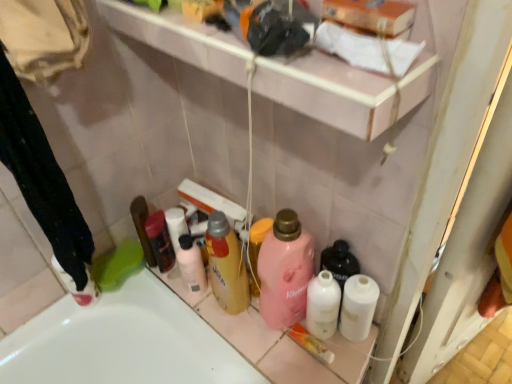
Question: In the image, is white paper towel at upper center positioned in front of or behind pink matte bottle at center, the first cleaning product positioned from the right?

Choices:
 (A) front
 (B) behind

Answer: (A)

Question: Considering the positions of point (417, 52) and point (312, 256), is point (417, 52) closer or farther from the camera than point (312, 256)?

Choices:
 (A) farther
 (B) closer

Answer: (B)

Question: Which is nearer to the black fabric laundry at lower left?

Choices:
 (A) white paper towel at upper center
 (B) matte black hair spray at left, placed as the 1th toiletry when sorted from left to right
 (C) translucent yellow bottle at center, the 2th cleaning product positioned from the right
 (D) pink matte lotion at center, positioned as the fourth toiletry in right-to-left order
 (E) pink matte bottle at center, the second cleaning product when ordered from left to right

Answer: (B)

Question: Which of these objects is positioned farthest from the pink glossy shelf at upper center?

Choices:
 (A) matte black hair spray at left, placed as the 1th toiletry when sorted from left to right
 (B) pink matte lotion at center, positioned as the fourth toiletry in right-to-left order
 (C) white matte bottle at lower right, the 5th toiletry positioned from the left
 (D) translucent yellow bottle at center, which appears as the 1th cleaning product when viewed from the left
 (E) pink matte bottle at center, the first cleaning product positioned from the right

Answer: (B)